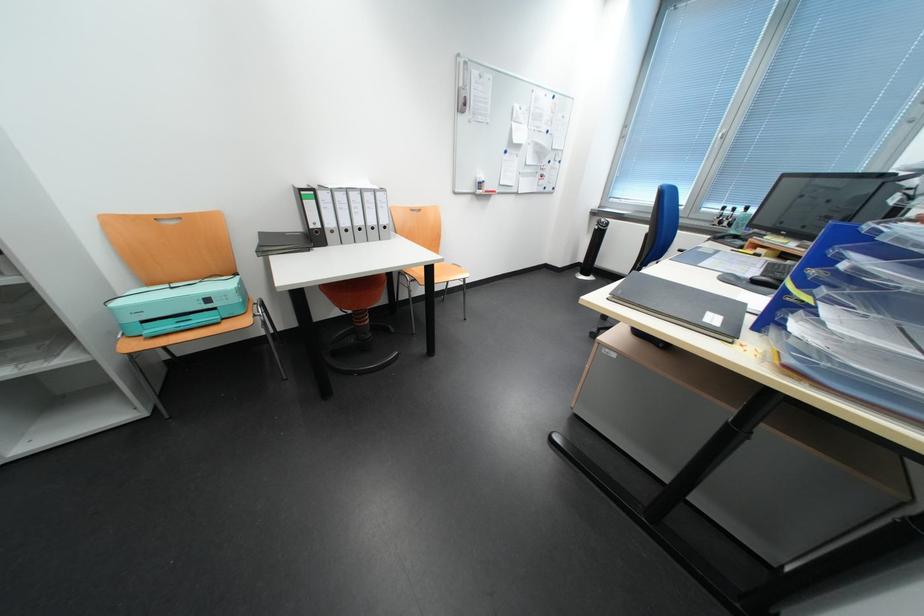
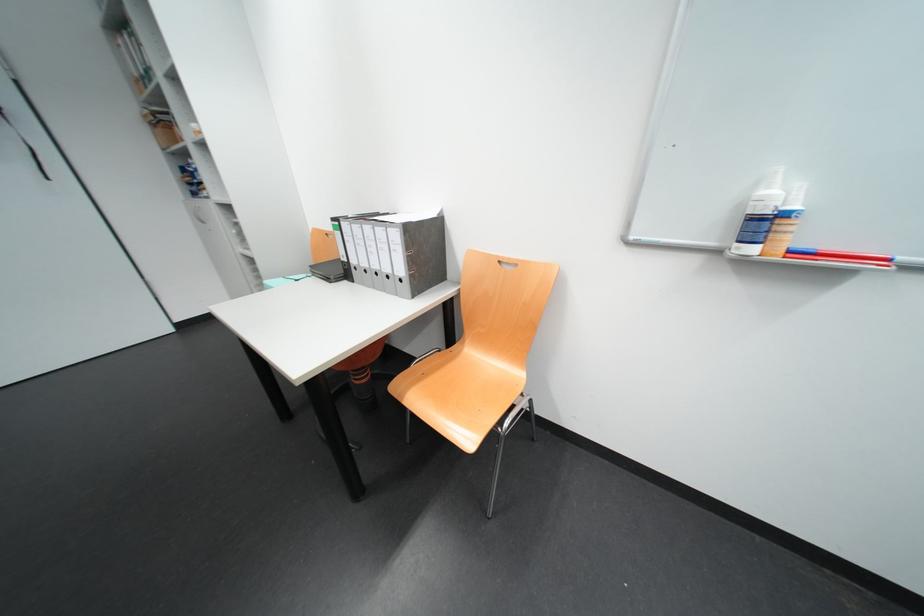
Where in the second image is the point corresponding to (x=331, y=228) from the first image?

(358, 262)